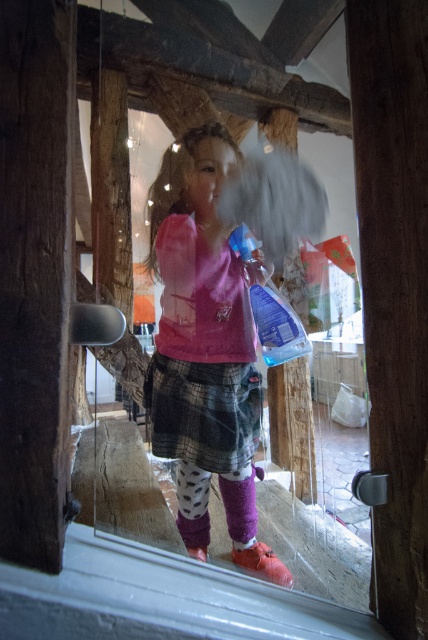
Question: Can you confirm if brown wooden door at center is positioned above purple fuzzy sock at lower center?

Choices:
 (A) yes
 (B) no

Answer: (A)

Question: Is pink fabric shirt at center bigger than transparent plastic bottle at center?

Choices:
 (A) yes
 (B) no

Answer: (A)

Question: Observing the image, what is the correct spatial positioning of pink fabric shirt at center in reference to transparent plastic bottle at center?

Choices:
 (A) above
 (B) below

Answer: (B)

Question: Estimate the real-world distances between objects in this image. Which object is closer to the transparent plastic bottle at center?

Choices:
 (A) purple fuzzy sock at lower center
 (B) patterned fabric sock at lower center
 (C) pink fabric shirt at center

Answer: (C)

Question: Which point is farther to the camera?

Choices:
 (A) (252, 241)
 (B) (193, 506)

Answer: (B)

Question: Among these points, which one is farthest from the camera?

Choices:
 (A) (252, 476)
 (B) (214, 154)
 (C) (395, 424)
 (D) (199, 476)

Answer: (A)